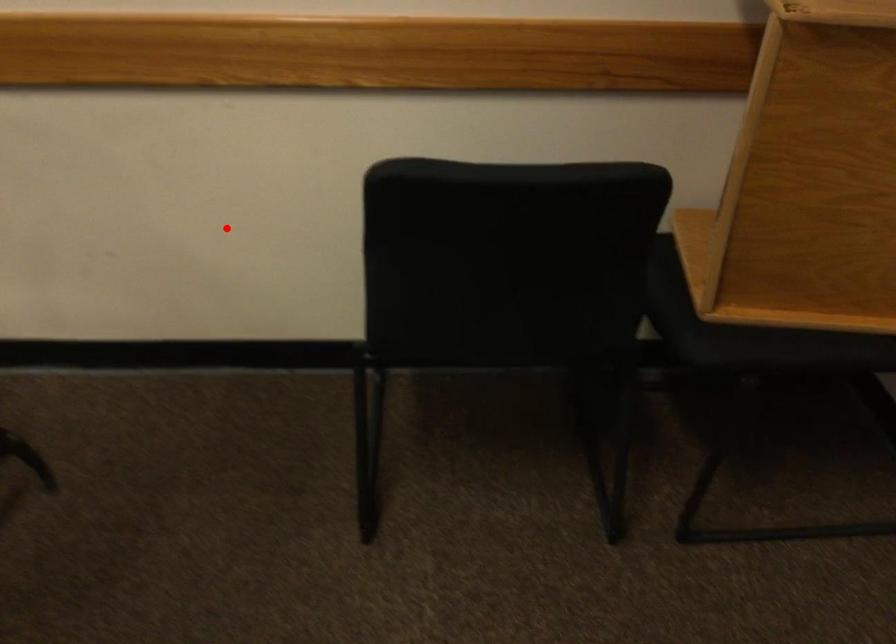
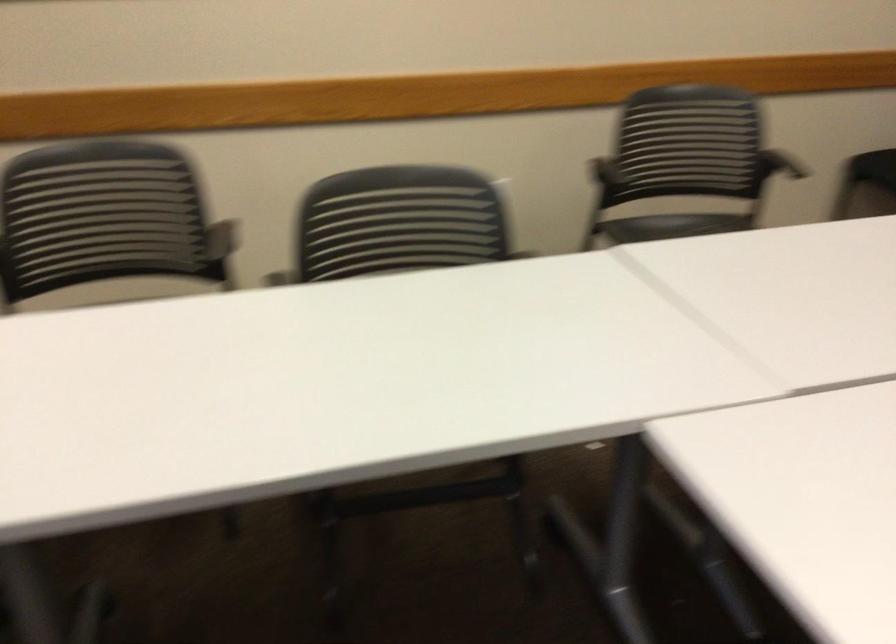
Question: I am providing you with two images of the same scene from different viewpoints. Image1 has a red point marked. In image2, the corresponding 3D location appears at what relative position? Reply with the corresponding letter.

Choices:
 (A) Closer
 (B) Farther

Answer: (B)